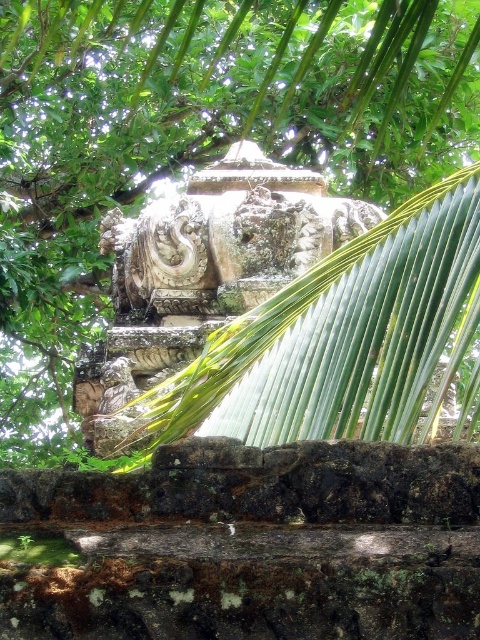
Does green leafy tree at upper center appear on the left side of carved stone sculpture at center?

Indeed, green leafy tree at upper center is positioned on the left side of carved stone sculpture at center.

Does green leafy tree at upper center appear under carved stone sculpture at center?

No, green leafy tree at upper center is not below carved stone sculpture at center.

Identify the location of green leafy tree at upper center. (181, 145).

Locate an element on the screen. green leafy tree at upper center is located at coordinates (181, 145).